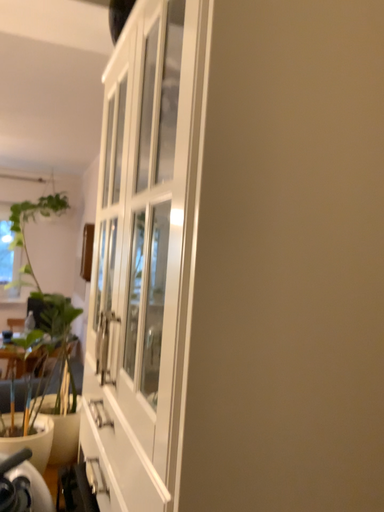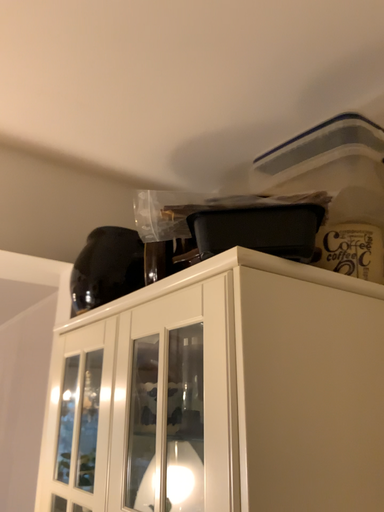
Question: Which way did the camera rotate in the video?

Choices:
 (A) rotated downward
 (B) rotated upward

Answer: (B)